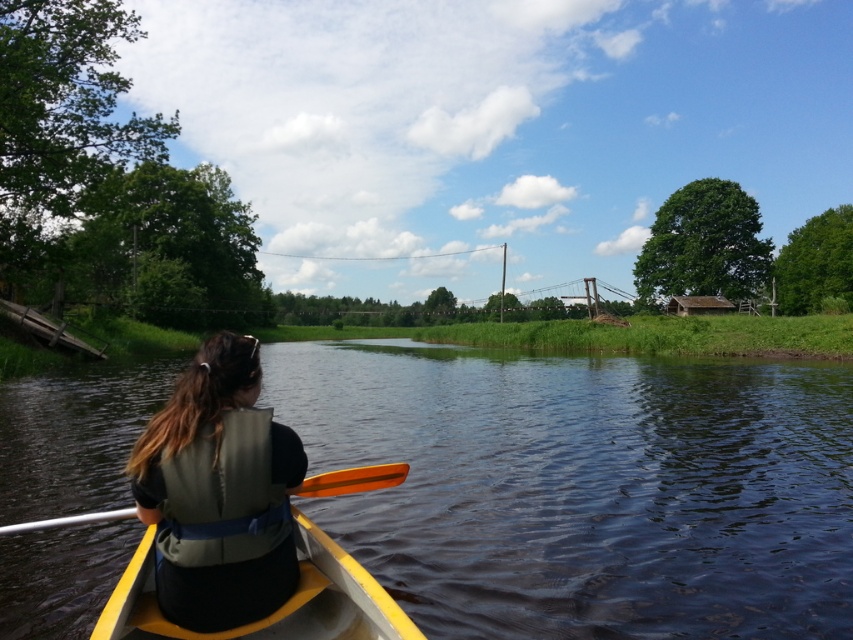
Question: Is green smooth water at center above gray fabric life vest at left?

Choices:
 (A) no
 (B) yes

Answer: (A)

Question: Can you confirm if green smooth water at center is positioned to the right of gray fabric life vest at left?

Choices:
 (A) no
 (B) yes

Answer: (B)

Question: Which point is closer to the camera taking this photo?

Choices:
 (A) (341, 486)
 (B) (434, 422)

Answer: (A)

Question: Which point is closer to the camera?

Choices:
 (A) yellow plastic canoe at lower center
 (B) orange wood paddle at center
 (C) green smooth water at center
 (D) gray fabric life vest at left

Answer: (A)

Question: Does gray fabric life vest at left have a greater width compared to orange wood paddle at center?

Choices:
 (A) yes
 (B) no

Answer: (A)

Question: Among these points, which one is farthest from the camera?

Choices:
 (A) (192, 493)
 (B) (665, 576)

Answer: (B)